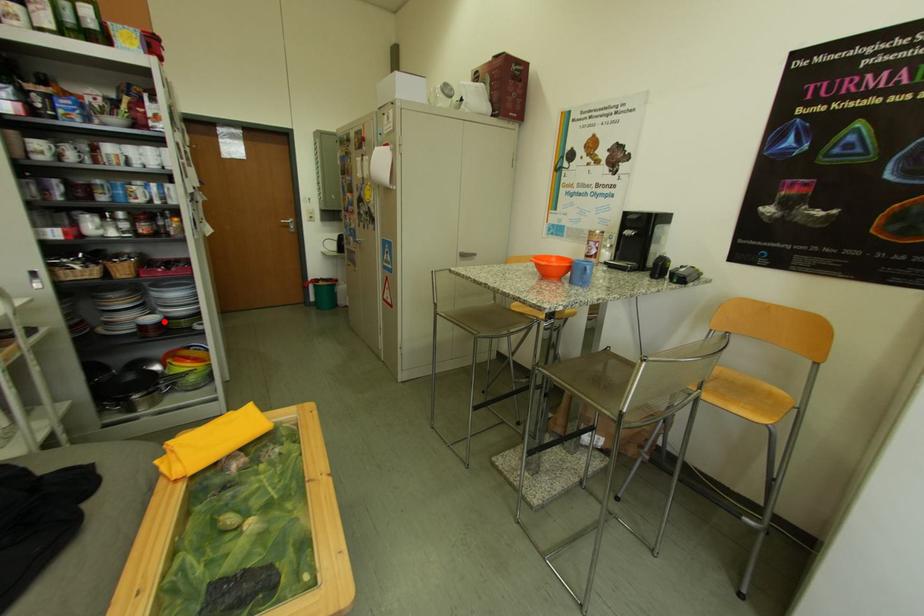
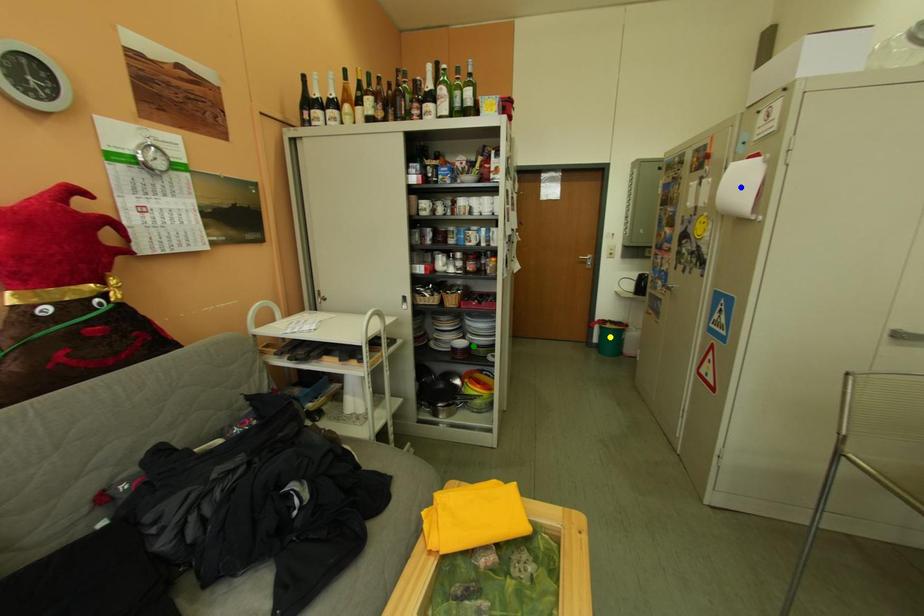
Question: I am providing you with two images of the same scene from different viewpoints. A red point is marked on the first image. You are given multiple points on the second image. Which spot in image 2 lines up with the point in image 1?

Choices:
 (A) green point
 (B) yellow point
 (C) blue point

Answer: (A)